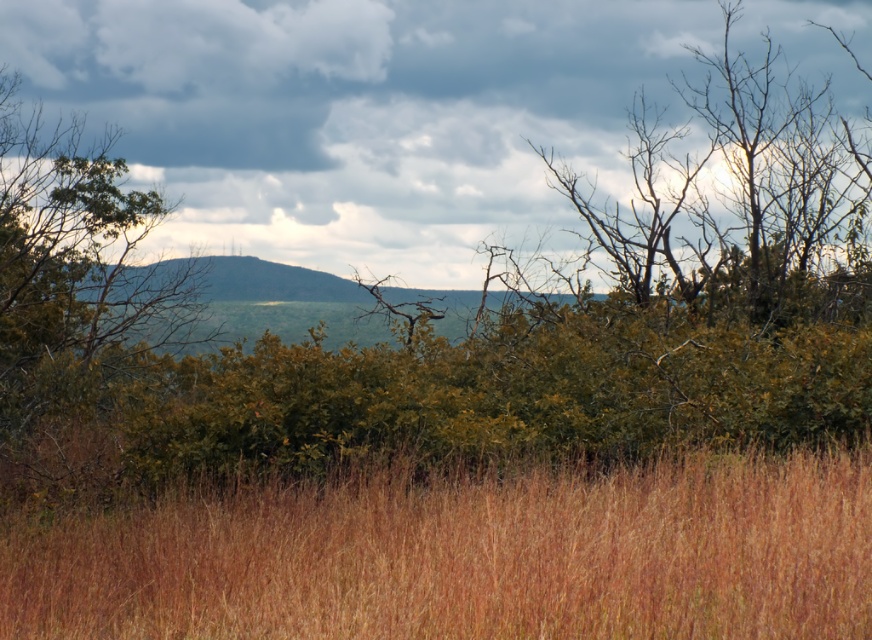
You are standing in the field of tall, golden grasses in the foreground. There is a point marked at coordinates [360,115]. What object in the scene is located at that point?

The cloudy sky at upper center is located at point [360,115].

You are standing at a viewpoint overlooking the landscape. You notice two points marked in the scene. Which point is closer to you, point (409, 241) or point (26, 221)?

Point (26, 221) is closer to you because the description states that point (409, 241) is further to the camera than point (26, 221).

You are a hiker trying to cross a field. You see the brown dry grass at lower center and the green leafy tree at left. Which one is wider in the image?

The brown dry grass at lower center is wider than the green leafy tree at left.